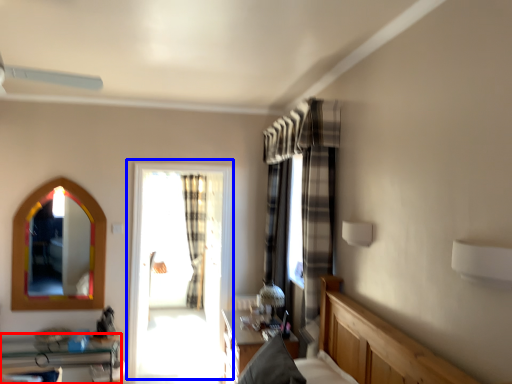
Question: Which object appears closest to the camera in this image, furniture (highlighted by a red box) or window (highlighted by a blue box)?

Choices:
 (A) furniture
 (B) window

Answer: (A)